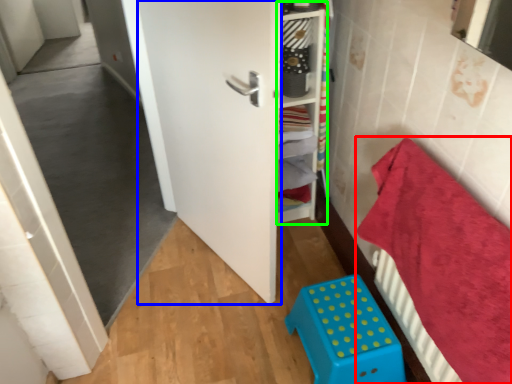
Question: Which is nearer to the bedding (highlighted by a red box)? door (highlighted by a blue box) or shelf (highlighted by a green box).

Choices:
 (A) door
 (B) shelf

Answer: (A)